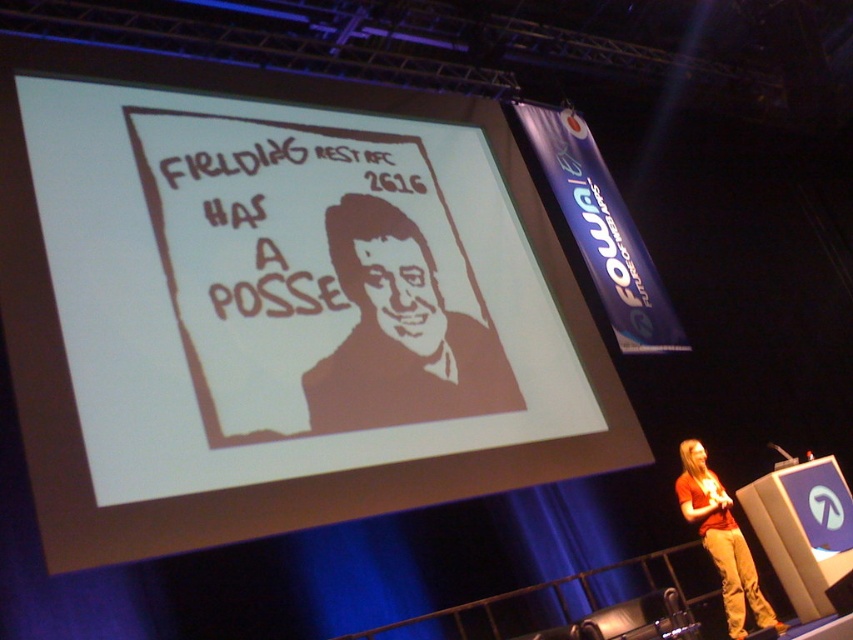
You are an attendee at the presentation. You want to take a photo of the brown paper portrait at center and the matte orange shirt at lower right. Which object should you focus on first to ensure both are in the frame?

You should focus on the brown paper portrait at center first because it is closer to you than the matte orange shirt at lower right, so adjusting the camera to include both would require ensuring the closer object is centered before including the farther one.

Based on the photo, you are standing in a presentation room and see the white paper at upper center. If you want to read the text on it without moving closer, what is the maximum distance you can maintain?

The white paper at upper center is 3.35 meters away from the viewer. Therefore, the maximum distance you can maintain to read it without moving closer is 3.35 meters.

You are an attendee at the presentation. You need to locate the white paper at upper center. Where exactly is it positioned in the image?

The white paper at upper center is positioned at coordinates point [277,305].